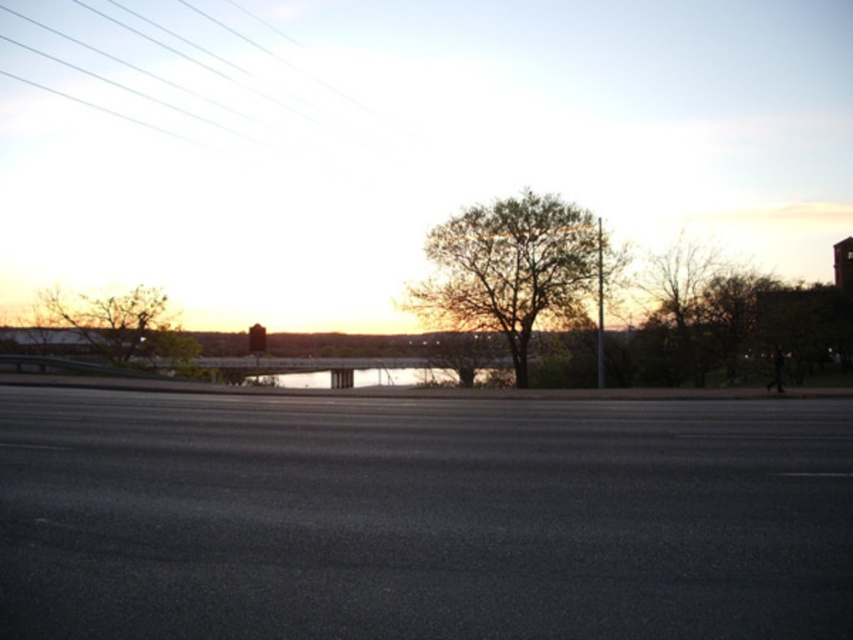
You are a drone operator who needs to fly a drone from the clear glass power lines at upper left to the green leafy tree at left. Given that the drone has a maximum flight range of 70 meters, can it reach the tree from the power lines?

The clear glass power lines at upper left is 72.81 meters away from the green leafy tree at left. Since the drone can only fly up to 70 meters, it cannot reach the tree from the power lines.

You are a drone operator planning to fly a drone over the scene. The drone has a maximum flight altitude of 0.2 meters. Based on the scene, will the drone be able to fly under the clear glass power lines at upper left without hitting them?

The clear glass power lines at upper left are positioned at point (204, 90). Since the drone can only fly up to 0.2 meters, it may not be able to safely pass under them as the power lines are at 0.240, which is higher than the drone s maximum altitude. However, without knowing the exact height measurement in meters corresponding to the coordinate system, this is an assumption based on relative positioning.

You are a photographer planning to capture the entire scene in one shot. Given that your camera can only focus on objects within a 10m width, will both the green leafy tree at left and the bare branches at right fit within the camera frame?

The green leafy tree at left is wider than the bare branches at right. However, the total combined width of both objects must be compared to the camera frame. Since their exact widths aren